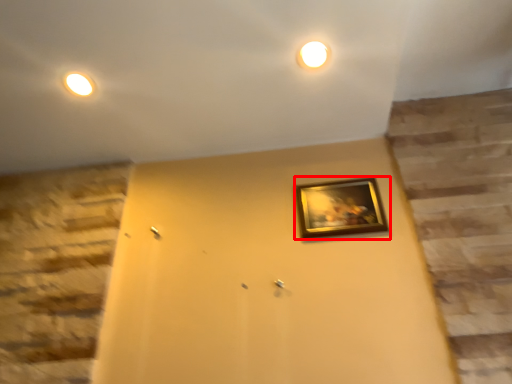
Question: From the image's perspective, considering the relative positions of picture frame (annotated by the red box) and light in the image provided, where is picture frame (annotated by the red box) located with respect to the staircase?

Choices:
 (A) above
 (B) below

Answer: (B)